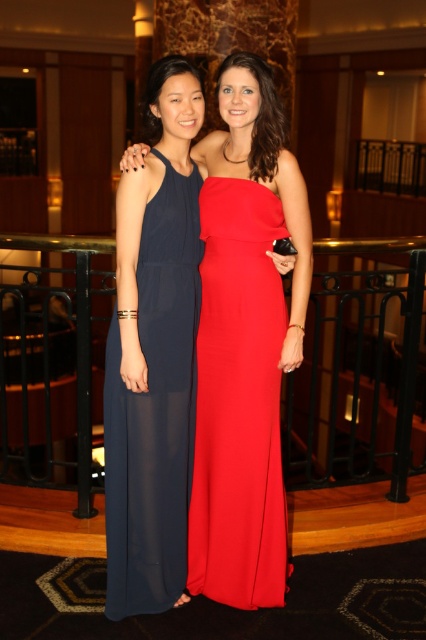
Question: Which object is farther from the camera taking this photo?

Choices:
 (A) navy sheer dress at left
 (B) matte black dress at center

Answer: (B)

Question: Can you confirm if matte red dress at center is positioned above navy sheer dress at left?

Choices:
 (A) yes
 (B) no

Answer: (B)

Question: Which object appears farthest from the camera in this image?

Choices:
 (A) navy sheer dress at left
 (B) black metal balustrade at center
 (C) matte black dress at center
 (D) matte red dress at center

Answer: (B)

Question: Is matte black dress at center bigger than matte red dress at center?

Choices:
 (A) no
 (B) yes

Answer: (B)

Question: Among these points, which one is nearest to the camera?

Choices:
 (A) (37, 273)
 (B) (224, 180)
 (C) (149, 280)
 (D) (273, 432)

Answer: (C)

Question: Does black metal balustrade at center appear on the right side of matte red dress at center?

Choices:
 (A) yes
 (B) no

Answer: (B)